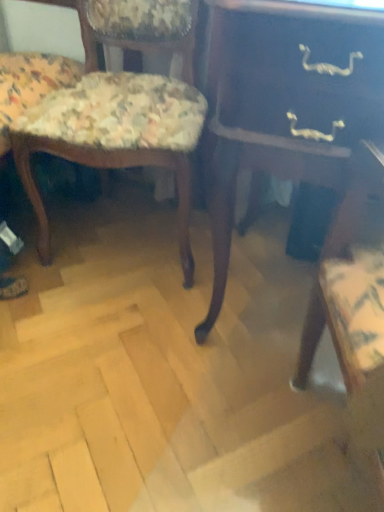
In order to click on vacant space underneath dark wood table at center (from a real-world perspective) in this screenshot , I will do `click(270, 294)`.